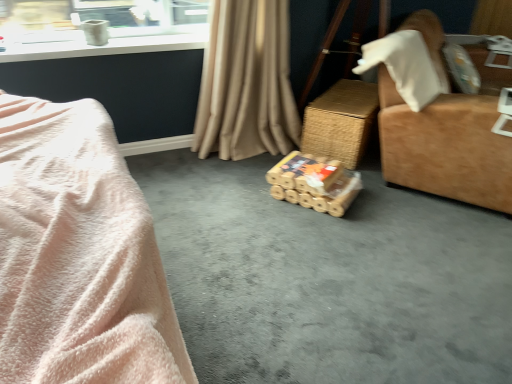
Question: Visually, is woven brown table at center positioned to the left or to the right of beige fabric curtain at center?

Choices:
 (A) left
 (B) right

Answer: (B)

Question: In terms of height, does woven brown table at center look taller or shorter compared to beige fabric curtain at center?

Choices:
 (A) tall
 (B) short

Answer: (B)

Question: Which of these objects is positioned closest to the brown cardboard boxes at center?

Choices:
 (A) suede-like brown armchair at right
 (B) woven brown table at center
 (C) beige fabric curtain at center
 (D) soft pink plush at left
 (E) bamboo-textured toy at center

Answer: (E)

Question: Estimate the real-world distances between objects in this image. Which object is farther from the suede-like brown armchair at right?

Choices:
 (A) brown cardboard boxes at center
 (B) beige fabric curtain at center
 (C) soft pink plush at left
 (D) bamboo-textured toy at center
 (E) woven brown table at center

Answer: (C)